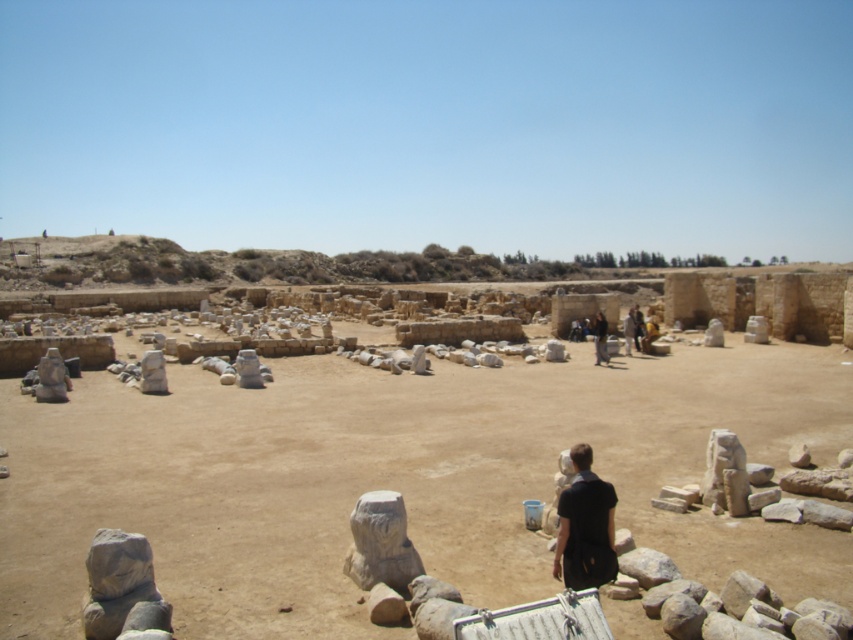
Question: Among these points, which one is farthest from the camera?

Choices:
 (A) (276, 532)
 (B) (567, 529)

Answer: (A)

Question: Does brown sandy dirt at center lie behind dark brown leather jacket at center?

Choices:
 (A) no
 (B) yes

Answer: (A)

Question: Is brown sandy dirt at center positioned in front of dark brown leather jacket at center?

Choices:
 (A) yes
 (B) no

Answer: (A)

Question: Which point is farther to the camera?

Choices:
 (A) black matte shirt at center
 (B) dark brown leather jacket at center

Answer: (B)

Question: Considering the real-world distances, which object is farthest from the brown sandy dirt at center?

Choices:
 (A) black matte shirt at center
 (B) dark brown leather jacket at center

Answer: (A)

Question: Does brown sandy dirt at center have a smaller size compared to dark brown leather jacket at center?

Choices:
 (A) yes
 (B) no

Answer: (B)